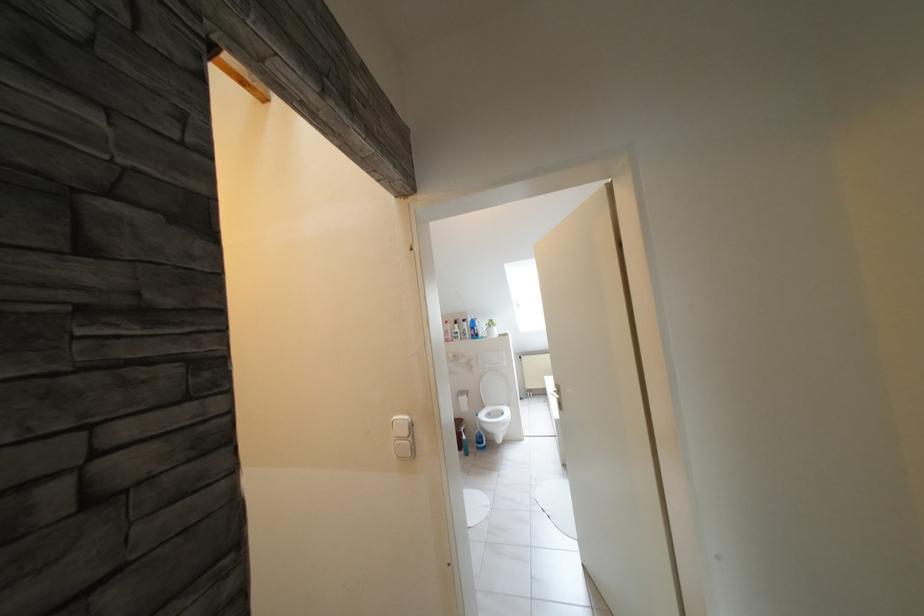
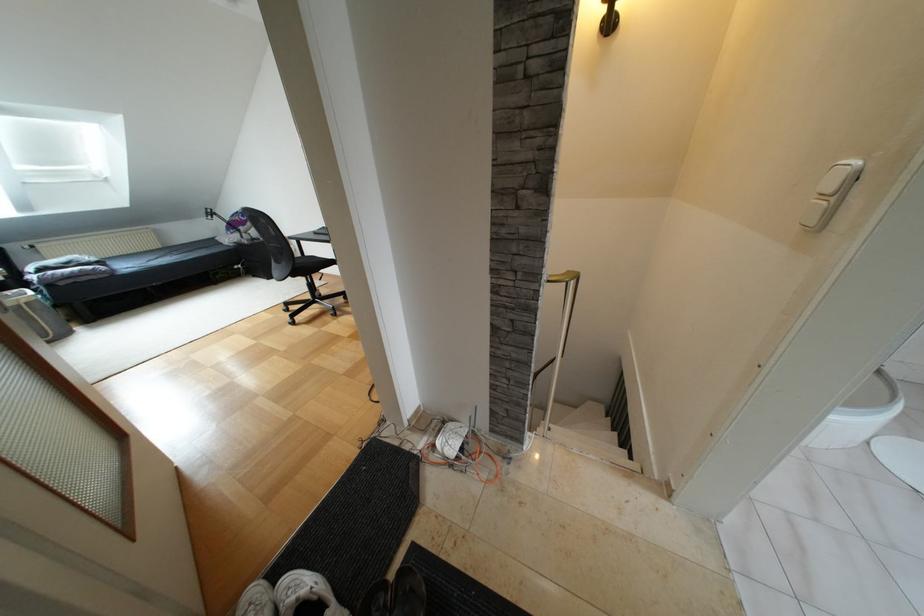
The images are taken continuously from a first-person perspective. In which direction is your viewpoint rotating?

The camera's rotation is toward left-down.